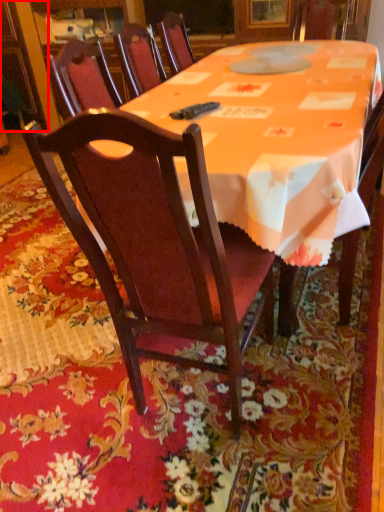
Question: From the image, what is the correct spatial relationship of cabinetry (annotated by the red box) in relation to chair?

Choices:
 (A) right
 (B) left

Answer: (B)